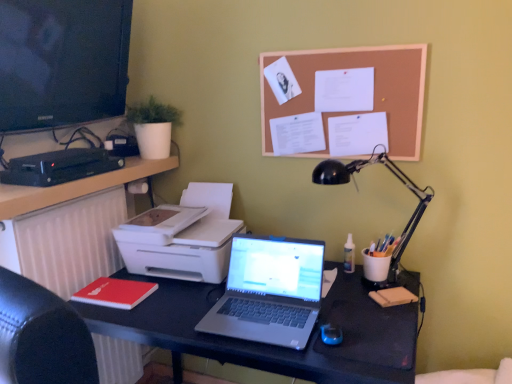
Question: Would you say black matte desk at center is to the left or to the right of black glossy screen at upper left in the picture?

Choices:
 (A) left
 (B) right

Answer: (B)

Question: From the image's perspective, is black matte desk at center located above or below black glossy screen at upper left?

Choices:
 (A) below
 (B) above

Answer: (A)

Question: Which is nearer to the white matte radiator at left?

Choices:
 (A) black plastic dvd player at left
 (B) silver metallic laptop at center
 (C) black glossy screen at upper left
 (D) red matte notepad at lower left
 (E) black metal desk lamp at right

Answer: (D)

Question: Estimate the real-world distances between objects in this image. Which object is farther from the corkboard at upper center?

Choices:
 (A) red matte notepad at lower left
 (B) black metal desk lamp at right
 (C) black matte desk at center
 (D) black glossy screen at upper left
 (E) white matte radiator at left

Answer: (A)